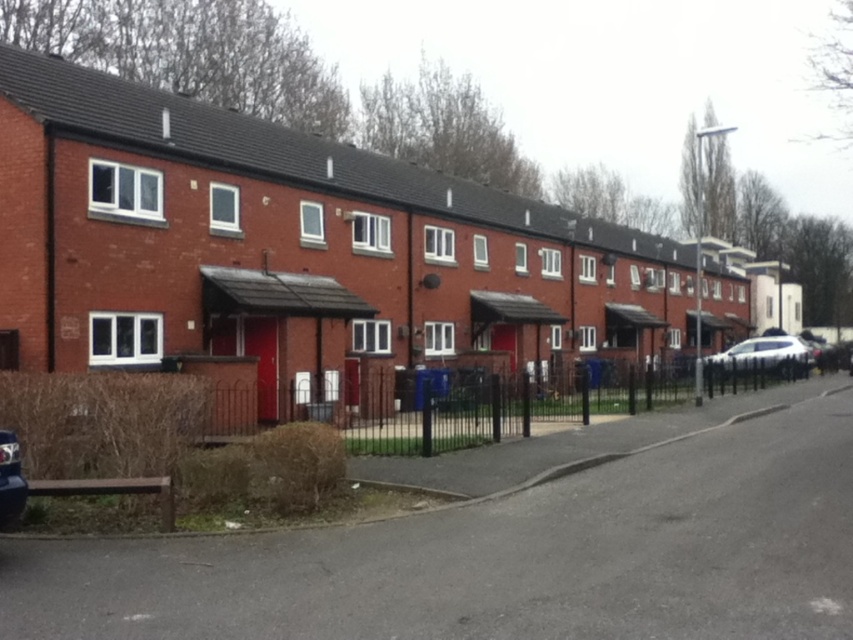
Does white glossy sedan at right appear on the right side of metallic silver car at lower left?

Yes, white glossy sedan at right is to the right of metallic silver car at lower left.

Between white glossy sedan at right and metallic silver car at lower left, which one has more height?

Standing taller between the two is white glossy sedan at right.

At what (x,y) coordinates should I click in order to perform the action: click on white glossy sedan at right. Please return your answer as a coordinate pair (x, y). This screenshot has width=853, height=640. Looking at the image, I should click on (764, 355).